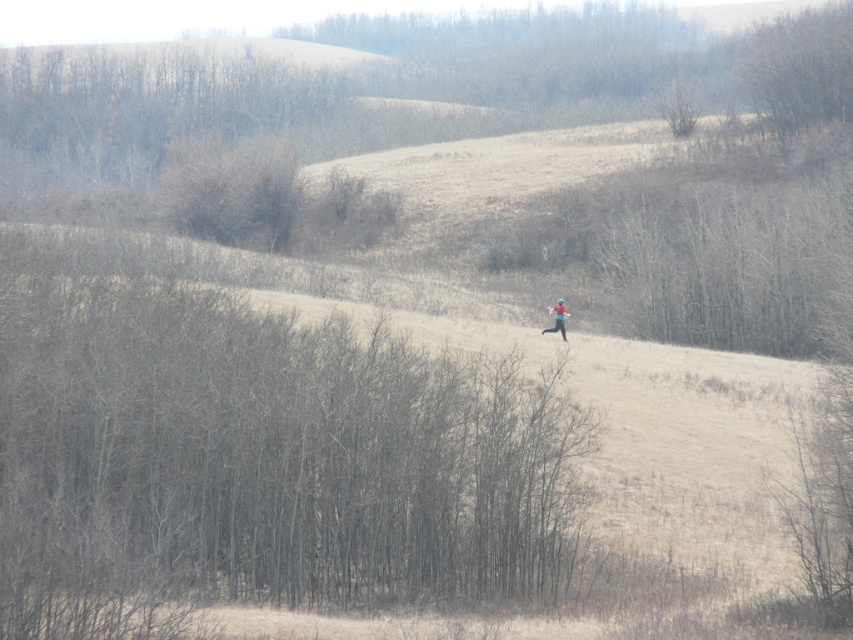
Question: Can you confirm if brown matte tree at center is positioned below bare branches at upper right?

Choices:
 (A) no
 (B) yes

Answer: (B)

Question: Can you confirm if brown matte tree at center is wider than blue fabric skier at center?

Choices:
 (A) yes
 (B) no

Answer: (A)

Question: Which point appears closest to the camera in this image?

Choices:
 (A) (544, 330)
 (B) (369, 595)
 (C) (764, 42)

Answer: (B)

Question: Is brown matte tree at center positioned at the back of blue fabric skier at center?

Choices:
 (A) no
 (B) yes

Answer: (A)

Question: Which point is farther to the camera?

Choices:
 (A) bare branches at upper right
 (B) blue fabric skier at center

Answer: (A)

Question: Which point is farther to the camera?

Choices:
 (A) bare branches at upper right
 (B) blue fabric skier at center

Answer: (A)